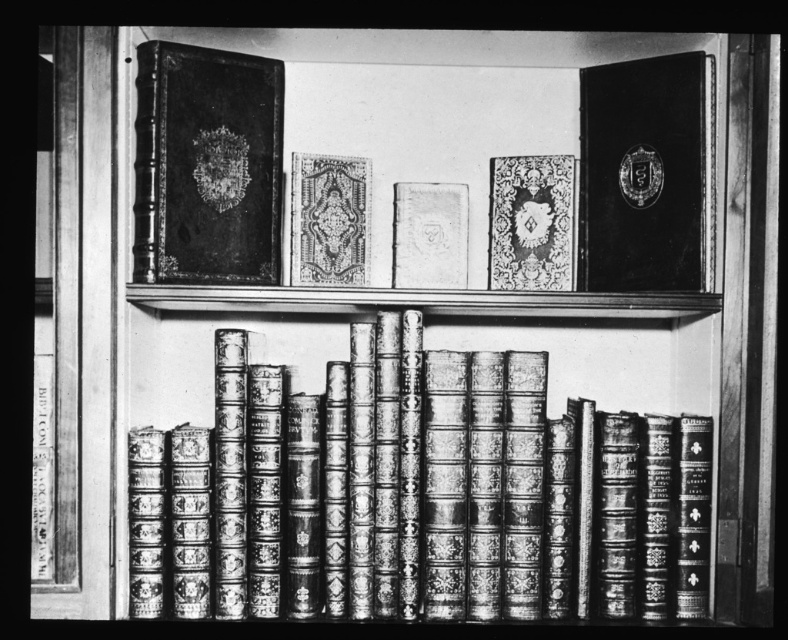
Question: Which is nearer to the matte leather book at center?

Choices:
 (A) matte gold-patterned book at center
 (B) decorative leather book at center
 (C) leather-bound books at center

Answer: (A)

Question: Is leather-bound books at center wider than shiny black book at upper right?

Choices:
 (A) no
 (B) yes

Answer: (B)

Question: Which object is closer to the camera taking this photo?

Choices:
 (A) leather-bound books at center
 (B) decorative leather book at center

Answer: (A)

Question: Estimate the real-world distances between objects in this image. Which object is farther from the matte gold-patterned book at center?

Choices:
 (A) decorative leather book at center
 (B) leather-bound books at center

Answer: (B)

Question: Does decorative leather book at center appear on the right side of matte gold-patterned book at center?

Choices:
 (A) no
 (B) yes

Answer: (B)

Question: Can you confirm if matte black book at upper left is smaller than decorative leather book at center?

Choices:
 (A) yes
 (B) no

Answer: (B)